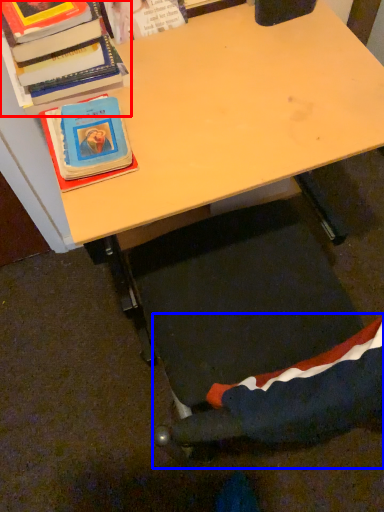
Question: Which of the following is the closest to the observer, book (highlighted by a red box) or swivel chair (highlighted by a blue box)?

Choices:
 (A) book
 (B) swivel chair

Answer: (B)